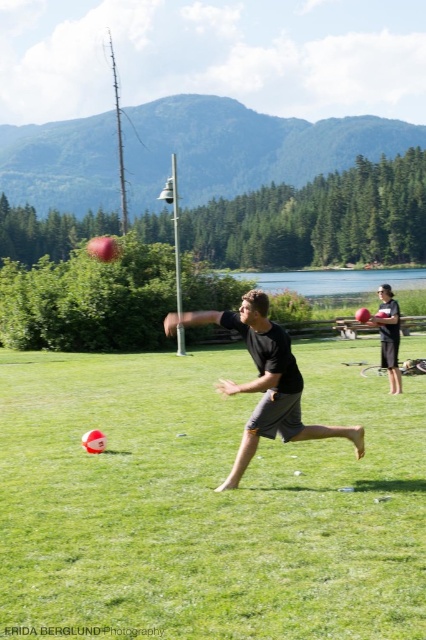
You are a photographer trying to capture the entire scene of the green grassy field at center and the matte black shorts at center. Which object would appear larger in your photo?

The green grassy field at center would appear larger in the photo since it is larger in size than the matte black shorts at center.

In the scene shown: You are a photographer trying to capture a photo of the black matte shirt at center and the matte black shorts at center. If you want to ensure both are in focus, which part of the person should you focus on first?

The black matte shirt at center is located below matte black shorts at center, so you should focus on the matte black shorts at center first since it is higher up and closer to the camera.

You are observing two people in the scene. The first person is wearing a black matte shirt at center and the second is wearing matte black shorts at center. From your perspective, which clothing item is positioned more to the left?

The black matte shirt at center is positioned to the left of the matte black shorts at center, so the black matte shirt at center is more to the left.